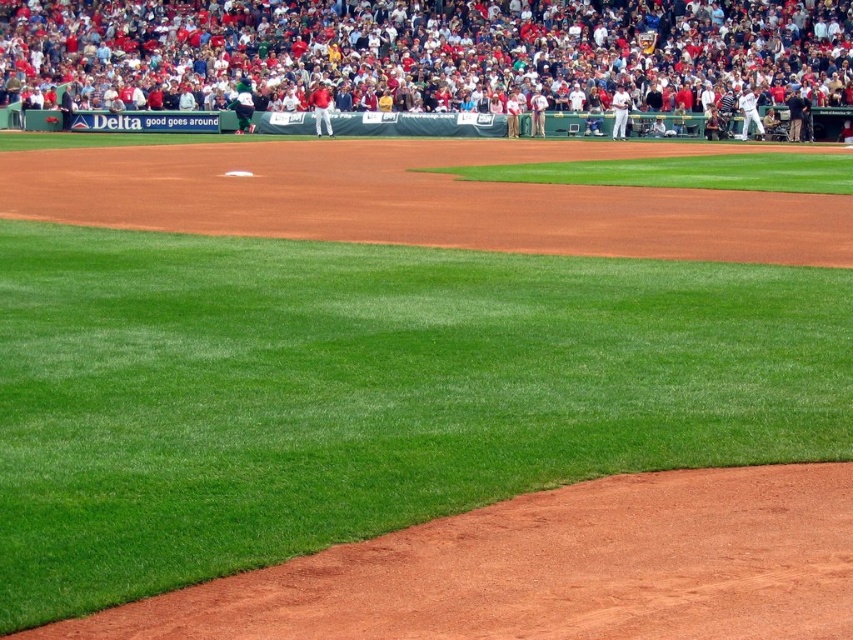
Does dark green jersey at upper center have a lesser width compared to white uniform at upper center?

No, dark green jersey at upper center is not thinner than white uniform at upper center.

Does point (238, 115) come in front of point (317, 120)?

No, (238, 115) is further to viewer.

Find the location of a particular element. Image resolution: width=853 pixels, height=640 pixels. dark green jersey at upper center is located at coordinates (242, 106).

Is the position of white uniformed player at upper center more distant than that of white uniform at upper right?

No, it is not.

Which is behind, point (766, 97) or point (622, 138)?

The point (622, 138) is behind.

Where is `white uniformed player at upper center`? The image size is (853, 640). white uniformed player at upper center is located at coordinates (432, 61).

Is white uniform at upper center wider than white uniform at upper right?

No, white uniform at upper center is not wider than white uniform at upper right.

Between white uniform at upper center and white uniform at upper right, which one has more height?

Standing taller between the two is white uniform at upper right.

The height and width of the screenshot is (640, 853). I want to click on white uniform at upper center, so click(x=321, y=108).

At what (x,y) coordinates should I click in order to perform the action: click on white uniform at upper center. Please return your answer as a coordinate pair (x, y). Looking at the image, I should click on (321, 108).